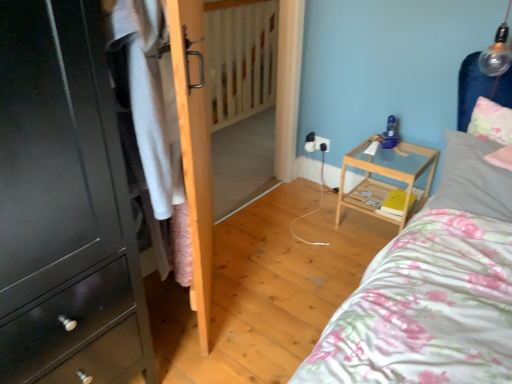
At what (x,y) coordinates should I click in order to perform the action: click on free region under wooden door at left (from a real-world perspective). Please return your answer as a coordinate pair (x, y). Looking at the image, I should click on (218, 287).